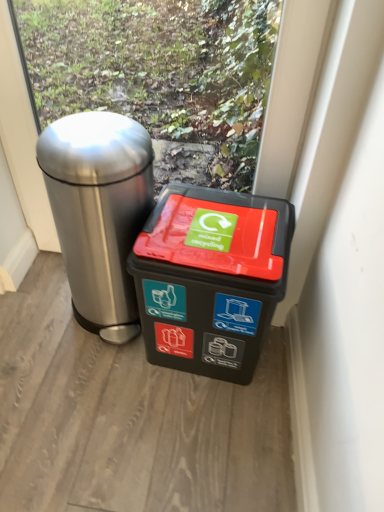
Describe the element at coordinates (99, 212) in the screenshot. The width and height of the screenshot is (384, 512). I see `polished stainless steel trash can at left, which ranks as the second waste container in right-to-left order` at that location.

Locate an element on the screen. This screenshot has width=384, height=512. polished stainless steel trash can at left, which ranks as the second waste container in right-to-left order is located at coordinates (99, 212).

This screenshot has height=512, width=384. What do you see at coordinates (210, 279) in the screenshot?
I see `black plastic recycling bin at center, which is the first waste container from right to left` at bounding box center [210, 279].

Find the location of a particular element. Image resolution: width=384 pixels, height=512 pixels. black plastic recycling bin at center, the 2th waste container viewed from the left is located at coordinates (210, 279).

This screenshot has width=384, height=512. I want to click on polished stainless steel trash can at left, which ranks as the second waste container in right-to-left order, so tap(99, 212).

Which object is positioned more to the right, polished stainless steel trash can at left, marked as the 1th waste container in a left-to-right arrangement, or black plastic recycling bin at center, which is the first waste container from right to left?

black plastic recycling bin at center, which is the first waste container from right to left, is more to the right.

Is polished stainless steel trash can at left, which ranks as the second waste container in right-to-left order, in front of or behind black plastic recycling bin at center, the 2th waste container viewed from the left, in the image?

In the image, polished stainless steel trash can at left, which ranks as the second waste container in right-to-left order, appears in front of black plastic recycling bin at center, the 2th waste container viewed from the left.

Looking at this image, which is less distant, [98,308] or [217,230]?

The point [217,230] is closer.

From the image's perspective, between polished stainless steel trash can at left, marked as the 1th waste container in a left-to-right arrangement, and black plastic recycling bin at center, the 2th waste container viewed from the left, who is located below?

black plastic recycling bin at center, the 2th waste container viewed from the left.

From a real-world perspective, is polished stainless steel trash can at left, marked as the 1th waste container in a left-to-right arrangement, positioned above or below black plastic recycling bin at center, the 2th waste container viewed from the left?

In terms of real-world spatial position, polished stainless steel trash can at left, marked as the 1th waste container in a left-to-right arrangement, is above black plastic recycling bin at center, the 2th waste container viewed from the left.

Can you confirm if polished stainless steel trash can at left, which ranks as the second waste container in right-to-left order, is wider than black plastic recycling bin at center, the 2th waste container viewed from the left?

Yes, polished stainless steel trash can at left, which ranks as the second waste container in right-to-left order, is wider than black plastic recycling bin at center, the 2th waste container viewed from the left.

Considering the sizes of objects polished stainless steel trash can at left, which ranks as the second waste container in right-to-left order, and black plastic recycling bin at center, the 2th waste container viewed from the left, in the image provided, who is shorter, polished stainless steel trash can at left, which ranks as the second waste container in right-to-left order, or black plastic recycling bin at center, the 2th waste container viewed from the left,?

black plastic recycling bin at center, the 2th waste container viewed from the left, is shorter.

Is polished stainless steel trash can at left, marked as the 1th waste container in a left-to-right arrangement, smaller than black plastic recycling bin at center, the 2th waste container viewed from the left?

Actually, polished stainless steel trash can at left, marked as the 1th waste container in a left-to-right arrangement, might be larger than black plastic recycling bin at center, the 2th waste container viewed from the left.

Is polished stainless steel trash can at left, marked as the 1th waste container in a left-to-right arrangement, completely or partially outside of black plastic recycling bin at center, the 2th waste container viewed from the left?

Yes, polished stainless steel trash can at left, marked as the 1th waste container in a left-to-right arrangement, is outside of black plastic recycling bin at center, the 2th waste container viewed from the left.

Is polished stainless steel trash can at left, which ranks as the second waste container in right-to-left order, not near black plastic recycling bin at center, the 2th waste container viewed from the left?

No, polished stainless steel trash can at left, which ranks as the second waste container in right-to-left order, is not far from black plastic recycling bin at center, the 2th waste container viewed from the left.

Is polished stainless steel trash can at left, which ranks as the second waste container in right-to-left order, positioned with its back to black plastic recycling bin at center, the 2th waste container viewed from the left?

No.

Measure the distance from polished stainless steel trash can at left, which ranks as the second waste container in right-to-left order, to black plastic recycling bin at center, which is the first waste container from right to left.

A distance of 8.86 inches exists between polished stainless steel trash can at left, which ranks as the second waste container in right-to-left order, and black plastic recycling bin at center, which is the first waste container from right to left.

This screenshot has width=384, height=512. In the image, there is a black plastic recycling bin at center, which is the first waste container from right to left. Identify the location of waste container above it (from the image's perspective). (99, 212).

Can you confirm if black plastic recycling bin at center, the 2th waste container viewed from the left, is positioned to the right of polished stainless steel trash can at left, marked as the 1th waste container in a left-to-right arrangement?

Yes.

Considering the positions of objects black plastic recycling bin at center, which is the first waste container from right to left, and polished stainless steel trash can at left, marked as the 1th waste container in a left-to-right arrangement, in the image provided, who is behind, black plastic recycling bin at center, which is the first waste container from right to left, or polished stainless steel trash can at left, marked as the 1th waste container in a left-to-right arrangement,?

black plastic recycling bin at center, which is the first waste container from right to left.

From the picture: Which is closer to the camera, (163, 269) or (141, 157)?

Point (163, 269)

From the image's perspective, which object appears higher, black plastic recycling bin at center, the 2th waste container viewed from the left, or polished stainless steel trash can at left, marked as the 1th waste container in a left-to-right arrangement?

From the image's view, polished stainless steel trash can at left, marked as the 1th waste container in a left-to-right arrangement, is above.

From a real-world perspective, between black plastic recycling bin at center, the 2th waste container viewed from the left, and polished stainless steel trash can at left, marked as the 1th waste container in a left-to-right arrangement, who is vertically lower?

From a 3D spatial view, black plastic recycling bin at center, the 2th waste container viewed from the left, is below.

Considering the relative sizes of black plastic recycling bin at center, the 2th waste container viewed from the left, and polished stainless steel trash can at left, which ranks as the second waste container in right-to-left order, in the image provided, is black plastic recycling bin at center, the 2th waste container viewed from the left, thinner than polished stainless steel trash can at left, which ranks as the second waste container in right-to-left order,?

Correct, the width of black plastic recycling bin at center, the 2th waste container viewed from the left, is less than that of polished stainless steel trash can at left, which ranks as the second waste container in right-to-left order.

Can you confirm if black plastic recycling bin at center, which is the first waste container from right to left, is shorter than polished stainless steel trash can at left, which ranks as the second waste container in right-to-left order?

Indeed, black plastic recycling bin at center, which is the first waste container from right to left, has a lesser height compared to polished stainless steel trash can at left, which ranks as the second waste container in right-to-left order.

Considering the sizes of black plastic recycling bin at center, which is the first waste container from right to left, and polished stainless steel trash can at left, marked as the 1th waste container in a left-to-right arrangement, in the image, is black plastic recycling bin at center, which is the first waste container from right to left, bigger or smaller than polished stainless steel trash can at left, marked as the 1th waste container in a left-to-right arrangement,?

black plastic recycling bin at center, which is the first waste container from right to left, is smaller than polished stainless steel trash can at left, marked as the 1th waste container in a left-to-right arrangement.

Is black plastic recycling bin at center, the 2th waste container viewed from the left, not within polished stainless steel trash can at left, marked as the 1th waste container in a left-to-right arrangement?

Yes, black plastic recycling bin at center, the 2th waste container viewed from the left, is not within polished stainless steel trash can at left, marked as the 1th waste container in a left-to-right arrangement.

Is black plastic recycling bin at center, the 2th waste container viewed from the left, not close to polished stainless steel trash can at left, which ranks as the second waste container in right-to-left order?

That's not correct — black plastic recycling bin at center, the 2th waste container viewed from the left, is a little close to polished stainless steel trash can at left, which ranks as the second waste container in right-to-left order.

Is black plastic recycling bin at center, the 2th waste container viewed from the left, aimed at polished stainless steel trash can at left, which ranks as the second waste container in right-to-left order?

No, black plastic recycling bin at center, the 2th waste container viewed from the left, is not facing towards polished stainless steel trash can at left, which ranks as the second waste container in right-to-left order.

How different are the orientations of black plastic recycling bin at center, which is the first waste container from right to left, and polished stainless steel trash can at left, which ranks as the second waste container in right-to-left order, in degrees?

The angle between the facing direction of black plastic recycling bin at center, which is the first waste container from right to left, and the facing direction of polished stainless steel trash can at left, which ranks as the second waste container in right-to-left order, is 5.18 degrees.

Consider the image. How distant is black plastic recycling bin at center, which is the first waste container from right to left, from polished stainless steel trash can at left, which ranks as the second waste container in right-to-left order?

black plastic recycling bin at center, which is the first waste container from right to left, and polished stainless steel trash can at left, which ranks as the second waste container in right-to-left order, are 8.86 inches apart.

You are a GUI agent. You are given a task and a screenshot of the screen. Output one action in this format:
    pyautogui.click(x=<x>, y=<y>)
    Task: Click on the waste container that appears below the polished stainless steel trash can at left, which ranks as the second waste container in right-to-left order (from the image's perspective)
    
    Given the screenshot: What is the action you would take?
    pyautogui.click(x=210, y=279)

Where is `waste container on the left of the black plastic recycling bin at center, the 2th waste container viewed from the left`? This screenshot has height=512, width=384. waste container on the left of the black plastic recycling bin at center, the 2th waste container viewed from the left is located at coordinates point(99,212).

Where is `waste container in front of the black plastic recycling bin at center, which is the first waste container from right to left`? Image resolution: width=384 pixels, height=512 pixels. waste container in front of the black plastic recycling bin at center, which is the first waste container from right to left is located at coordinates (99, 212).